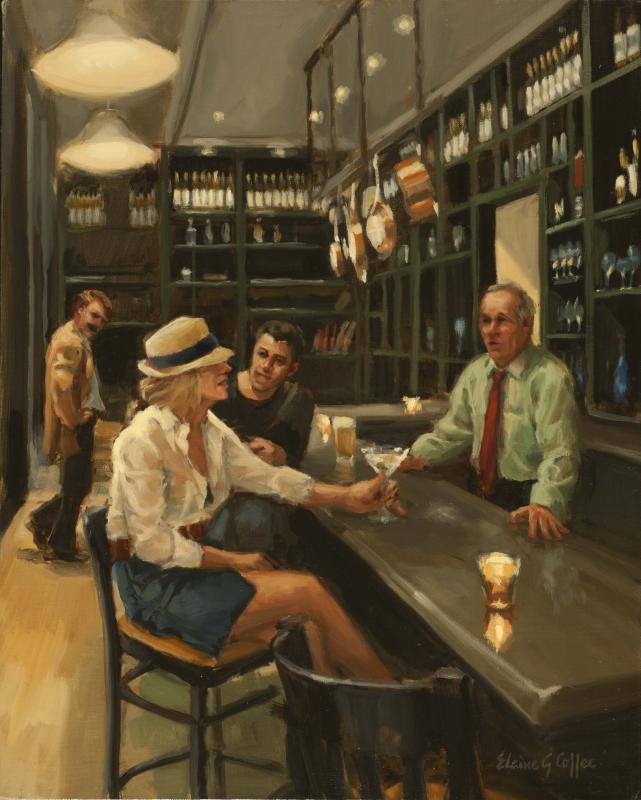
This screenshot has width=641, height=800. I want to click on painting, so click(x=313, y=320).